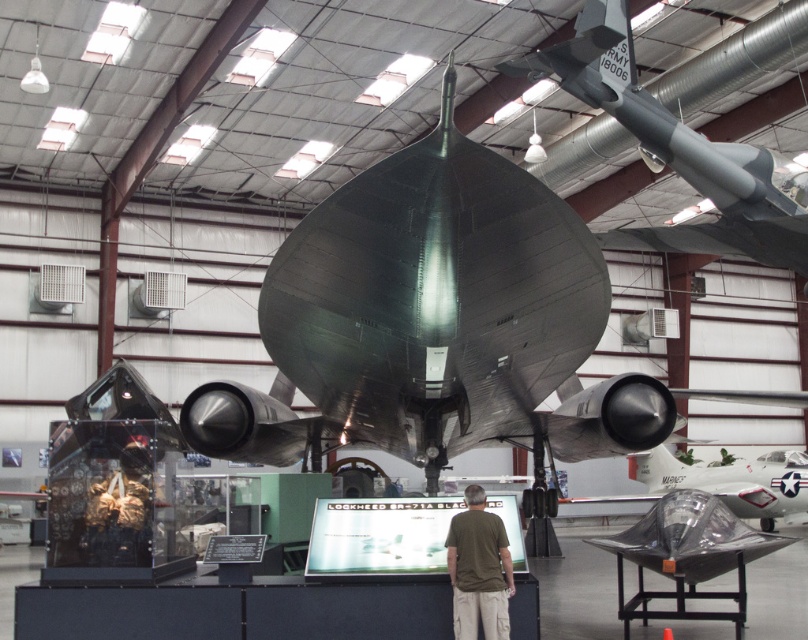
What object is located at the coordinates point (680, 154) in the hangar?

The point (680, 154) is on the matte gray missile at upper right.